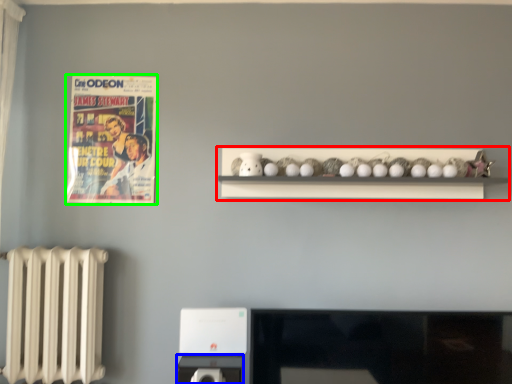
Question: Which object is positioned closest to shelf (highlighted by a red box)? Select from appliance (highlighted by a blue box) and comic book (highlighted by a green box).

Choices:
 (A) appliance
 (B) comic book

Answer: (B)